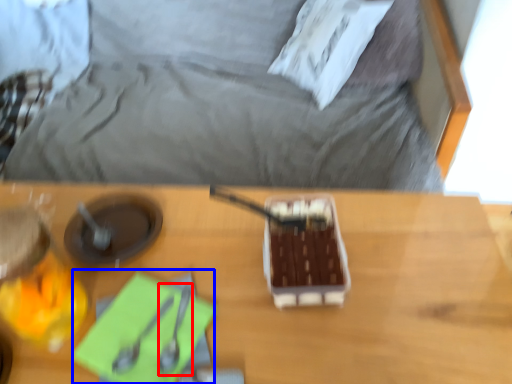
Question: Which of the following is the farthest to the observer, utensil (highlighted by a red box) or notepad (highlighted by a blue box)?

Choices:
 (A) utensil
 (B) notepad

Answer: (A)